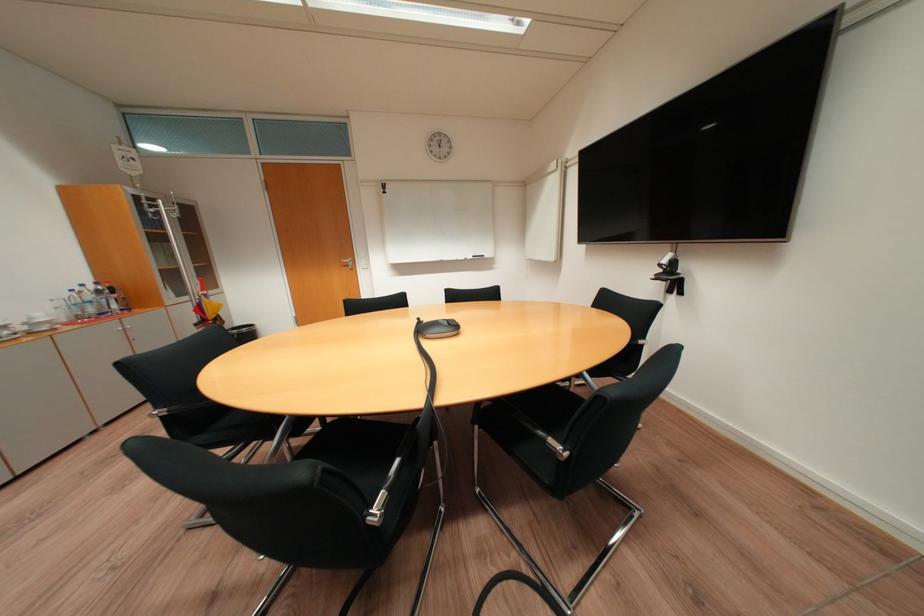
What are the coordinates of `red cap bottle` in the screenshot? It's located at (205, 309).